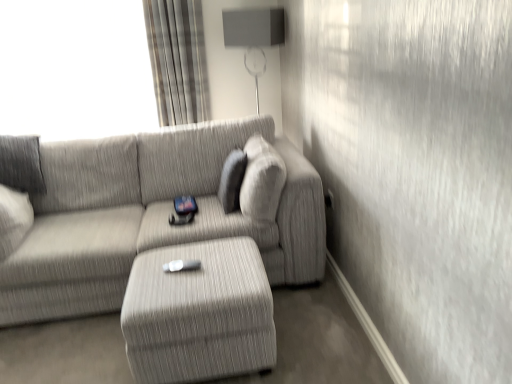
Image resolution: width=512 pixels, height=384 pixels. Identify the location of vacant space positioned to the left of white matte wii controller at center. (153, 263).